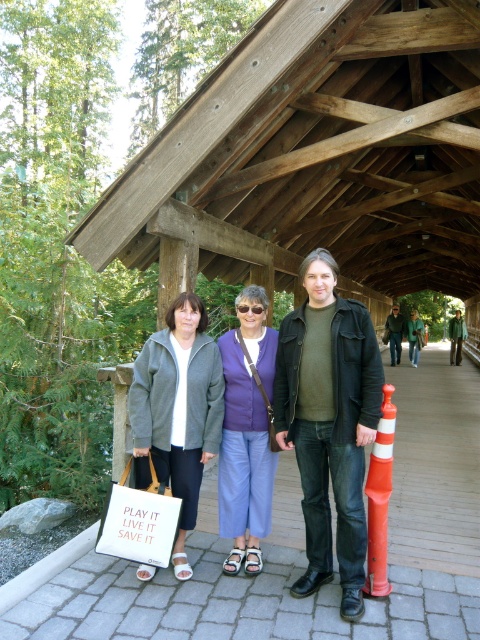
Question: Does matte gray jacket at center appear on the left side of matte purple sweater at center?

Choices:
 (A) no
 (B) yes

Answer: (B)

Question: Can you confirm if matte gray jacket at center is bigger than matte purple sweater at center?

Choices:
 (A) yes
 (B) no

Answer: (A)

Question: Does matte gray jacket at center have a smaller size compared to matte purple sweater at center?

Choices:
 (A) no
 (B) yes

Answer: (A)

Question: Which point appears farthest from the camera in this image?

Choices:
 (A) (233, 404)
 (B) (213, 346)

Answer: (B)